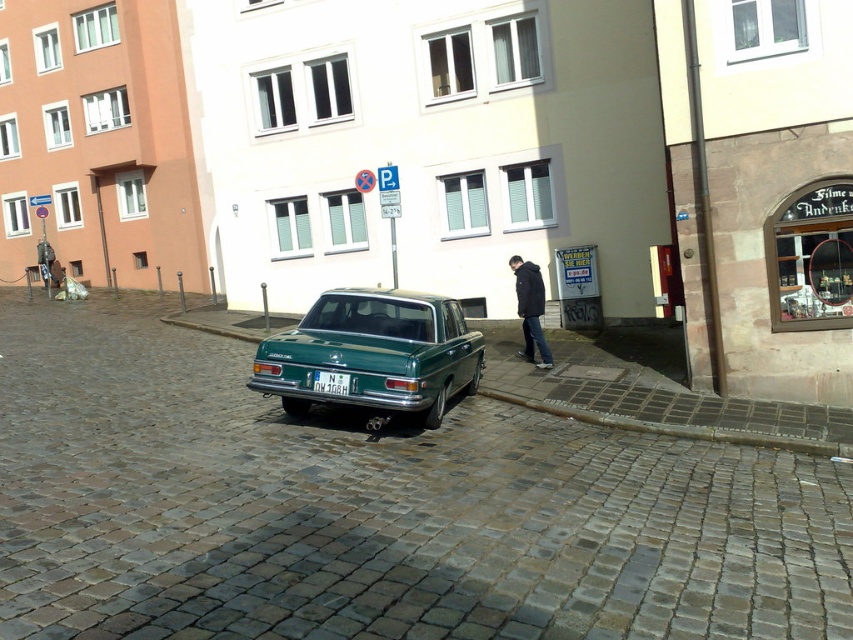
Question: Can you confirm if green metallic curb at lower center is positioned to the right of white plastic license plate at center?

Choices:
 (A) yes
 (B) no

Answer: (A)

Question: Which point appears closest to the camera in this image?

Choices:
 (A) (339, 342)
 (B) (212, 316)
 (C) (537, 337)

Answer: (A)

Question: Considering the real-world distances, which object is farthest from the black matte jacket at center?

Choices:
 (A) green metallic car at center
 (B) green metallic curb at lower center
 (C) white plastic license plate at center

Answer: (C)

Question: Is green metallic curb at lower center to the left of black matte jacket at center from the viewer's perspective?

Choices:
 (A) yes
 (B) no

Answer: (A)

Question: Based on their relative distances, which object is nearer to the green metallic curb at lower center?

Choices:
 (A) green metallic car at center
 (B) black matte jacket at center
 (C) white plastic license plate at center

Answer: (B)

Question: Can you confirm if green metallic car at center is smaller than green metallic curb at lower center?

Choices:
 (A) no
 (B) yes

Answer: (B)